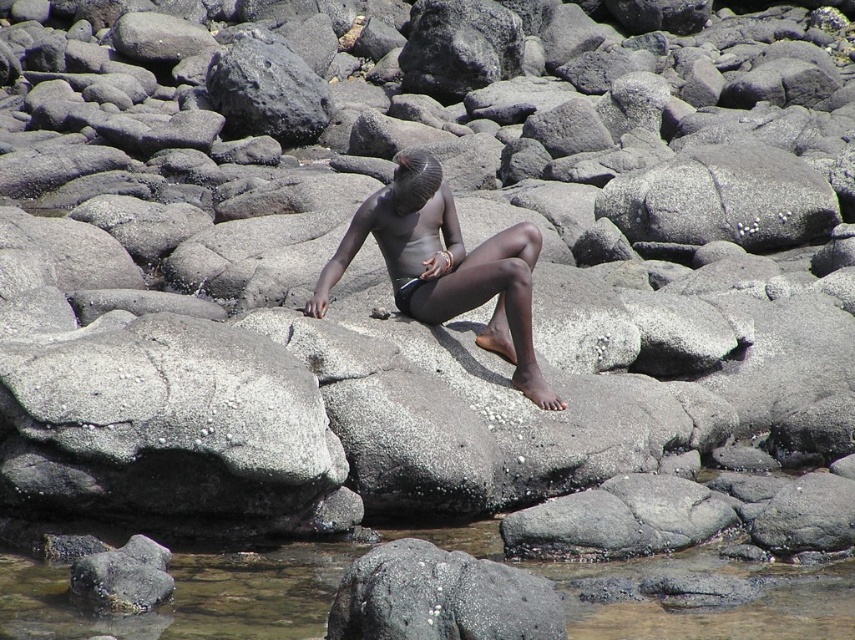
Is clear water at river bottom left closer to camera compared to matte black skin at center?

That is True.

Who is more distant from viewer, (x=246, y=579) or (x=516, y=356)?

The point (x=516, y=356) is more distant.

I want to click on clear water at river bottom left, so click(x=187, y=596).